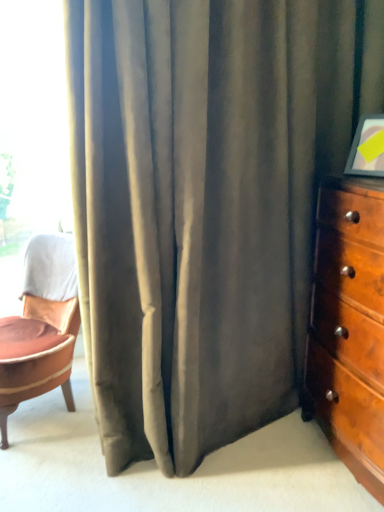
Question: Is leather cushioned chair at left positioned beyond the bounds of wooden dresser at right?

Choices:
 (A) no
 (B) yes

Answer: (B)

Question: Is leather cushioned chair at left at the right side of wooden dresser at right?

Choices:
 (A) no
 (B) yes

Answer: (A)

Question: Is leather cushioned chair at left turned away from wooden dresser at right?

Choices:
 (A) yes
 (B) no

Answer: (B)

Question: Is the position of leather cushioned chair at left less distant than that of wooden dresser at right?

Choices:
 (A) yes
 (B) no

Answer: (B)

Question: Is leather cushioned chair at left touching wooden dresser at right?

Choices:
 (A) yes
 (B) no

Answer: (B)

Question: Considering the positions of transparent glass window at upper left and leather cushioned chair at left in the image, is transparent glass window at upper left taller or shorter than leather cushioned chair at left?

Choices:
 (A) short
 (B) tall

Answer: (B)

Question: Is transparent glass window at upper left bigger or smaller than leather cushioned chair at left?

Choices:
 (A) small
 (B) big

Answer: (A)

Question: In terms of width, does transparent glass window at upper left look wider or thinner when compared to leather cushioned chair at left?

Choices:
 (A) wide
 (B) thin

Answer: (B)

Question: Is transparent glass window at upper left in front of or behind leather cushioned chair at left in the image?

Choices:
 (A) behind
 (B) front

Answer: (A)

Question: From the image's perspective, is wooden dresser at right located above or below leather cushioned chair at left?

Choices:
 (A) below
 (B) above

Answer: (B)

Question: Visually, is wooden dresser at right positioned to the left or to the right of leather cushioned chair at left?

Choices:
 (A) left
 (B) right

Answer: (B)

Question: From a real-world perspective, is wooden dresser at right above or below leather cushioned chair at left?

Choices:
 (A) below
 (B) above

Answer: (B)

Question: Is wooden dresser at right situated inside leather cushioned chair at left or outside?

Choices:
 (A) outside
 (B) inside

Answer: (A)

Question: Is leather cushioned chair at left bigger or smaller than wooden dresser at right?

Choices:
 (A) big
 (B) small

Answer: (B)

Question: From a real-world perspective, is leather cushioned chair at left above or below wooden dresser at right?

Choices:
 (A) below
 (B) above

Answer: (A)